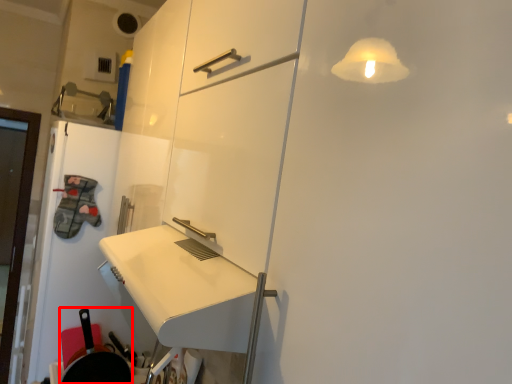
Question: Where is frying pan (annotated by the red box) located in relation to door in the image?

Choices:
 (A) right
 (B) left

Answer: (A)